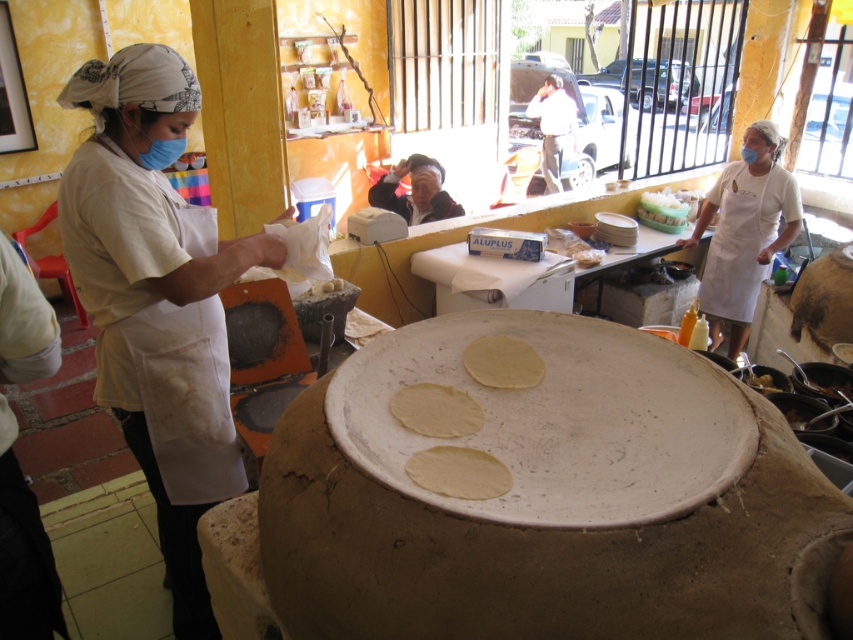
You are a customer observing the kitchen scene. You notice the white matte apron at left and the white glossy tortillas at center. Which object is positioned lower in the image?

The white matte apron at left is located below the white glossy tortillas at center, so it is positioned lower in the image.

You are a customer observing the kitchen scene. You notice a white apron at right and a yellow matte tortilla at center. Which object is positioned to the right side of the other?

The white apron at right is to the right of the yellow matte tortilla at center.